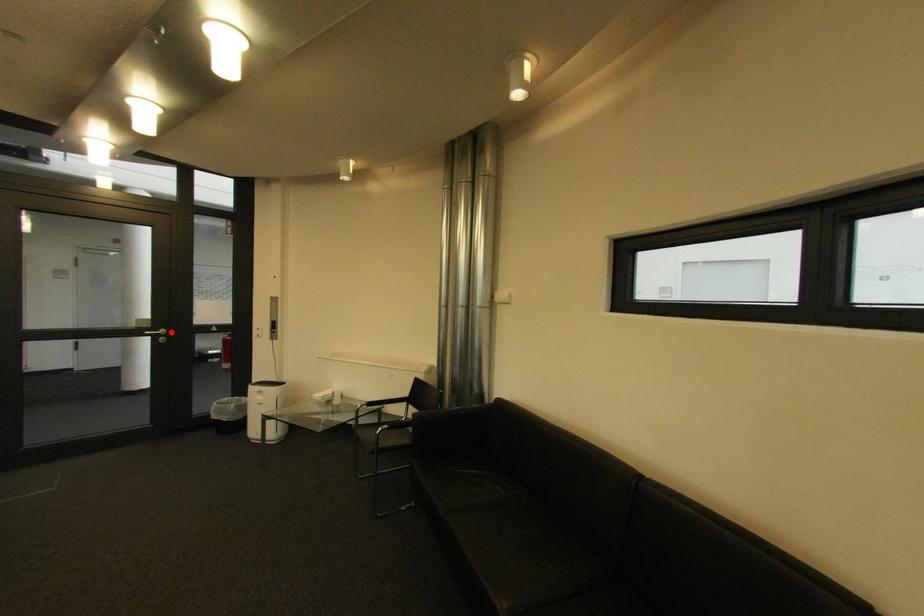
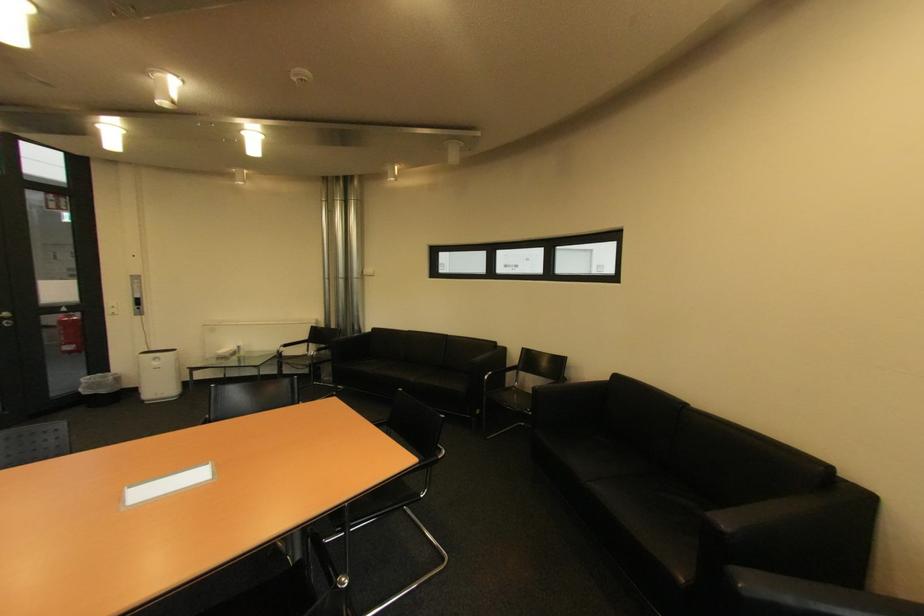
In the second image, find the point that corresponds to the highlighted location in the first image.

(14, 315)